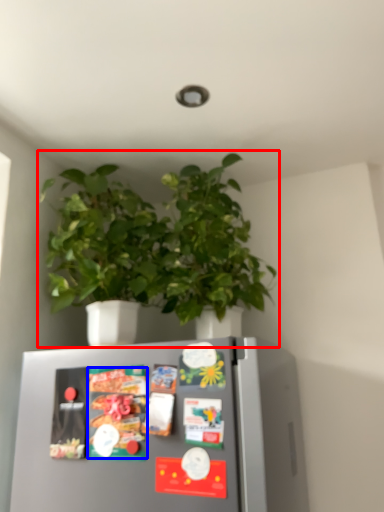
Question: Which object appears farthest to the camera in this image, houseplant (highlighted by a red box) or food (highlighted by a blue box)?

Choices:
 (A) houseplant
 (B) food

Answer: (A)